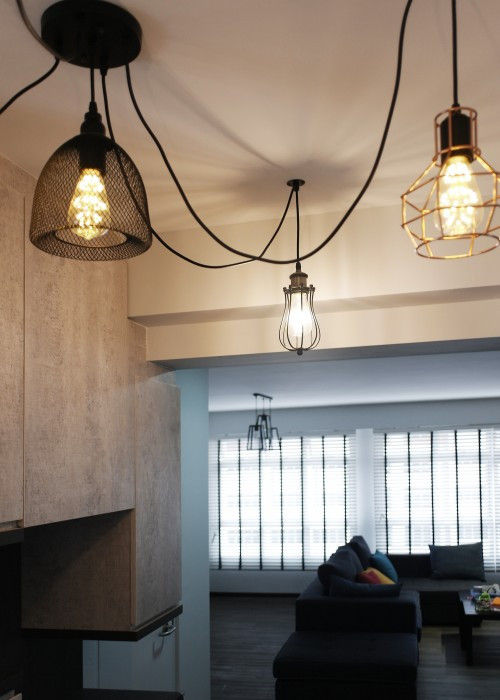
In order to click on coffee table in this screenshot , I will do `click(469, 609)`.